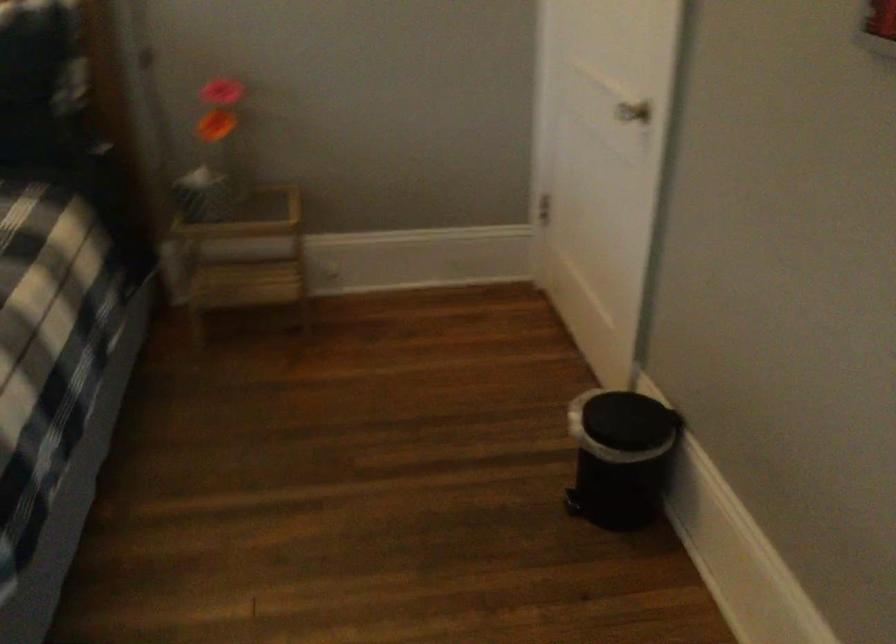
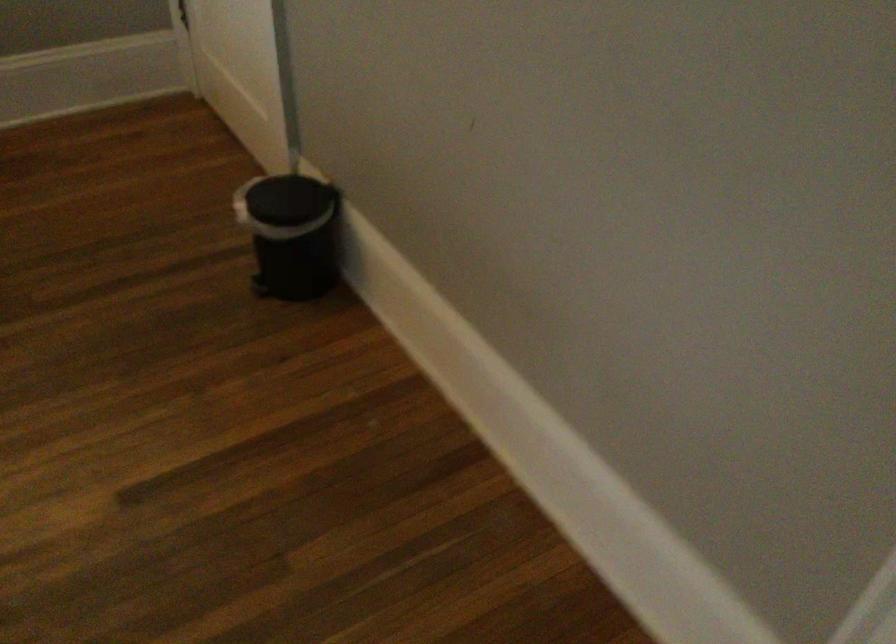
Question: The first image is from the beginning of the video and the second image is from the end. How did the camera likely rotate when shooting the video?

Choices:
 (A) Left
 (B) Right
 (C) Up
 (D) Down

Answer: (B)